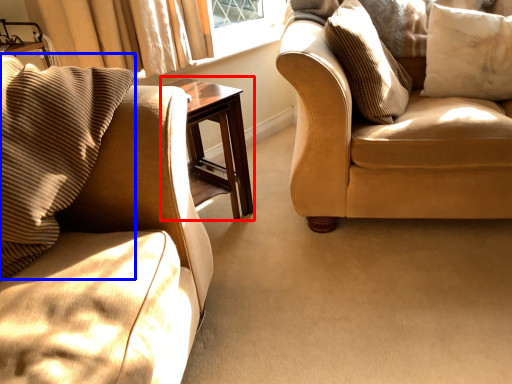
Question: Among these objects, which one is farthest to the camera, table (highlighted by a red box) or pillow (highlighted by a blue box)?

Choices:
 (A) table
 (B) pillow

Answer: (A)